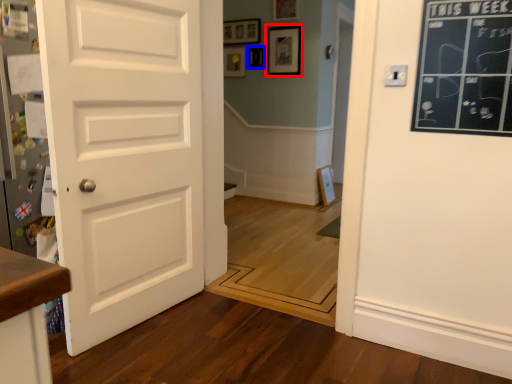
Question: Which object appears farthest to the camera in this image, picture frame (highlighted by a red box) or picture frame (highlighted by a blue box)?

Choices:
 (A) picture frame
 (B) picture frame

Answer: (B)